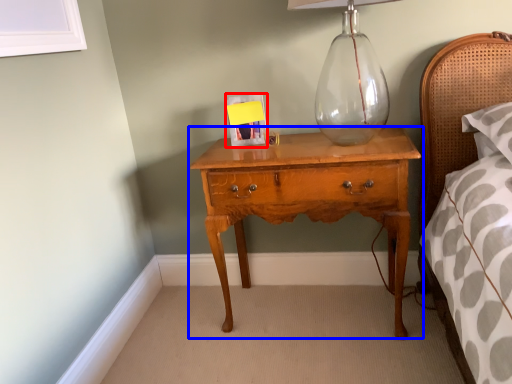
Question: Among these objects, which one is nearest to the camera, picture frame (highlighted by a red box) or nightstand (highlighted by a blue box)?

Choices:
 (A) picture frame
 (B) nightstand

Answer: (B)